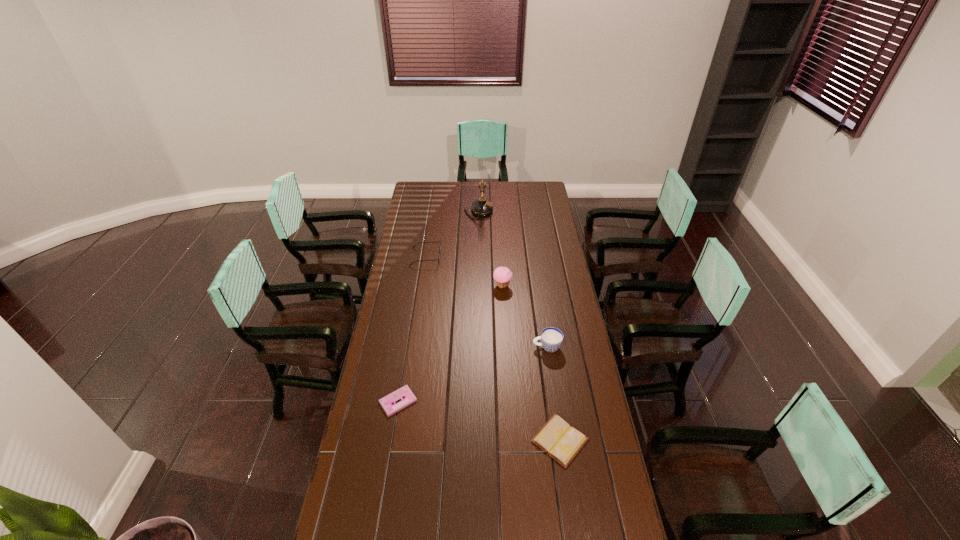
This screenshot has width=960, height=540. Identify the location of vacant space that satisfies the following two spatial constraints: 1. on the back side of the third farthest object; 2. on the dial of the telephone. (498, 212).

At what (x,y) coordinates should I click in order to perform the action: click on vacant position in the image that satisfies the following two spatial constraints: 1. on the back side of the fifth shortest object; 2. on the dial of the tallest object. Please return your answer as a coordinate pair (x, y). Image resolution: width=960 pixels, height=540 pixels. Looking at the image, I should click on (498, 212).

The width and height of the screenshot is (960, 540). I want to click on vacant space that satisfies the following two spatial constraints: 1. on the dial of the tallest object; 2. on the left side of the second tallest object, so click(478, 286).